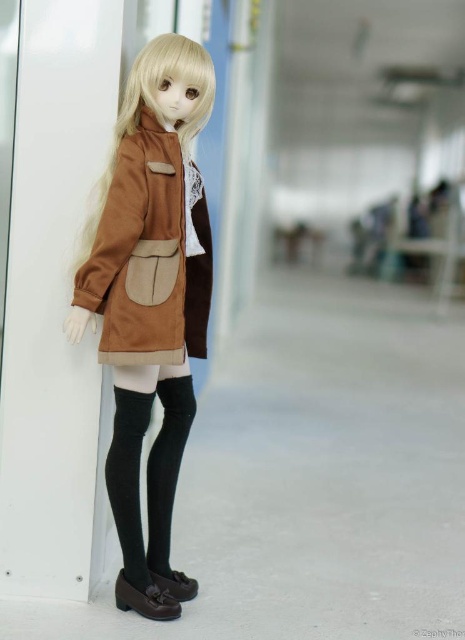
You are a photographer adjusting your camera to focus on two points in the image. You want to know which point is closer to you. The points are point (194, 90) and point (179, 378). Which point is closer?

Point (194, 90) is closer to the viewer than point (179, 378).

You are a fashion designer who wants to create a new outfit for a doll. You have the brown suede jacket at center and the black knit tights at lower center. The jacket must be placed exactly 15 inches away from the tights in the final design. Based on their current positions, do you need to move the jacket or the tights to achieve this distance?

The brown suede jacket at center is currently 14.96 inches away from the black knit tights at lower center. Since the desired distance is 15 inches, you need to move either the jacket or the tights by approximately 0.04 inches to achieve the required 15 inches distance between them.